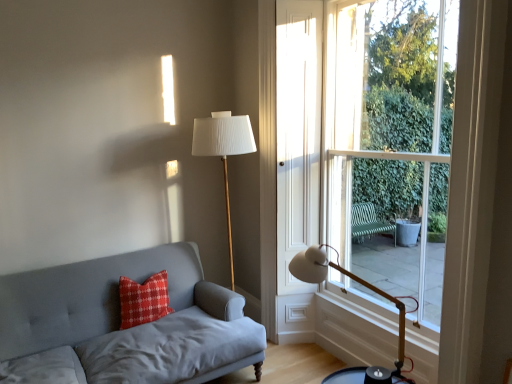
Question: Is white pleated fabric lampshade at center, which is the first table lamp from back to front, oriented away from white matte table lamp at lower right, which ranks as the 1th table lamp in front-to-back order?

Choices:
 (A) yes
 (B) no

Answer: (B)

Question: Can you confirm if white pleated fabric lampshade at center, which is the first table lamp from back to front, is positioned to the left of white matte table lamp at lower right, which ranks as the 1th table lamp in front-to-back order?

Choices:
 (A) yes
 (B) no

Answer: (A)

Question: Can you confirm if white pleated fabric lampshade at center, marked as the first table lamp in a left-to-right arrangement, is positioned to the right of white matte table lamp at lower right, which ranks as the 1th table lamp in front-to-back order?

Choices:
 (A) no
 (B) yes

Answer: (A)

Question: Considering the relative positions of white pleated fabric lampshade at center, the 2th table lamp from the right, and white matte table lamp at lower right, positioned as the second table lamp in back-to-front order, in the image provided, is white pleated fabric lampshade at center, the 2th table lamp from the right, in front of white matte table lamp at lower right, positioned as the second table lamp in back-to-front order,?

Choices:
 (A) yes
 (B) no

Answer: (B)

Question: From the image's perspective, is white pleated fabric lampshade at center, the second table lamp when ordered from front to back, beneath white matte table lamp at lower right, which ranks as the 1th table lamp in front-to-back order?

Choices:
 (A) yes
 (B) no

Answer: (B)

Question: Is matte gray fabric couch at left to the left or to the right of clear glass window at right in the image?

Choices:
 (A) left
 (B) right

Answer: (A)

Question: From their relative heights in the image, would you say matte gray fabric couch at left is taller or shorter than clear glass window at right?

Choices:
 (A) tall
 (B) short

Answer: (B)

Question: From a real-world perspective, is matte gray fabric couch at left positioned above or below clear glass window at right?

Choices:
 (A) below
 (B) above

Answer: (A)

Question: Is matte gray fabric couch at left wider or thinner than clear glass window at right?

Choices:
 (A) wide
 (B) thin

Answer: (A)

Question: From a real-world perspective, relative to matte gray fabric couch at left, is clear glass window at right vertically above or below?

Choices:
 (A) above
 (B) below

Answer: (A)

Question: Which is correct: clear glass window at right is inside matte gray fabric couch at left, or outside of it?

Choices:
 (A) outside
 (B) inside

Answer: (A)

Question: Does point (335, 69) appear closer or farther from the camera than point (58, 269)?

Choices:
 (A) farther
 (B) closer

Answer: (A)

Question: From their relative heights in the image, would you say clear glass window at right is taller or shorter than matte gray fabric couch at left?

Choices:
 (A) short
 (B) tall

Answer: (B)

Question: Considering the positions of clear glass window at right and white pleated fabric lampshade at center, which is the first table lamp from back to front, in the image, is clear glass window at right taller or shorter than white pleated fabric lampshade at center, which is the first table lamp from back to front,?

Choices:
 (A) tall
 (B) short

Answer: (A)

Question: Considering the positions of clear glass window at right and white pleated fabric lampshade at center, which is the first table lamp from back to front, in the image, is clear glass window at right wider or thinner than white pleated fabric lampshade at center, which is the first table lamp from back to front,?

Choices:
 (A) wide
 (B) thin

Answer: (B)